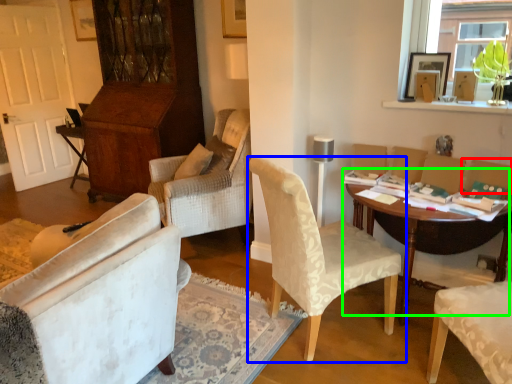
Question: Which object is the closest to the armchair (highlighted by a red box)? Choose among these: chair (highlighted by a blue box) or table (highlighted by a green box).

Choices:
 (A) chair
 (B) table

Answer: (B)